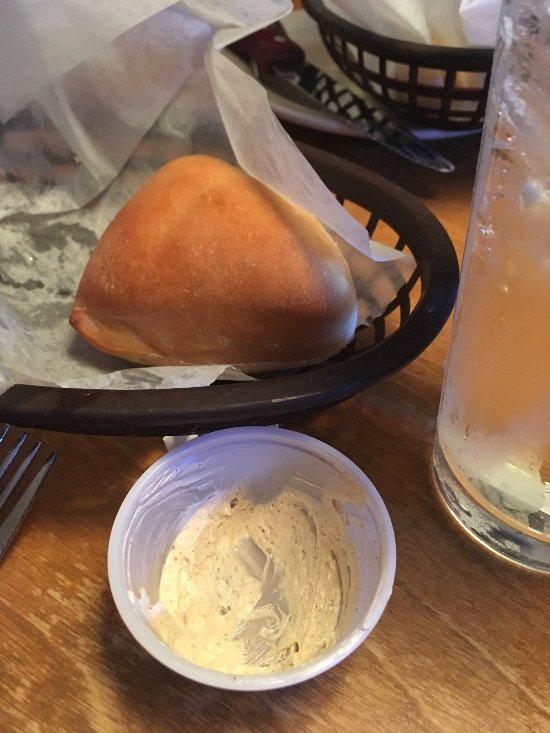
Locate an element on the screen. Image resolution: width=550 pixels, height=733 pixels. sheet is located at coordinates (63, 239).